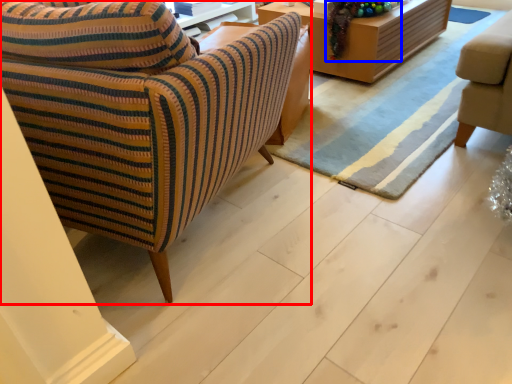
Question: Which of the following is the closest to the observer, chair (highlighted by a red box) or christmas decoration (highlighted by a blue box)?

Choices:
 (A) chair
 (B) christmas decoration

Answer: (A)